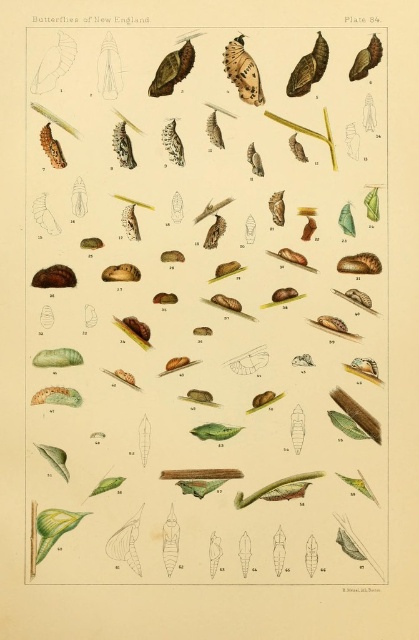
Is green leafy plant at center bigger than speckled brown butterfly at upper center?

Correct, green leafy plant at center is larger in size than speckled brown butterfly at upper center.

Is point (157, 28) in front of point (245, 92)?

Yes.

Is point (307, 408) positioned in front of point (248, 97)?

No, (307, 408) is behind (248, 97).

The width and height of the screenshot is (419, 640). Find the location of `green leafy plant at center`. green leafy plant at center is located at coordinates (204, 307).